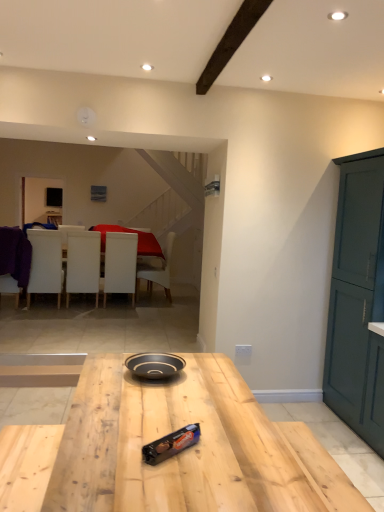
Find the location of a particular element. This screenshot has width=384, height=512. vacant space behind shiny chocolate bar at center is located at coordinates (180, 423).